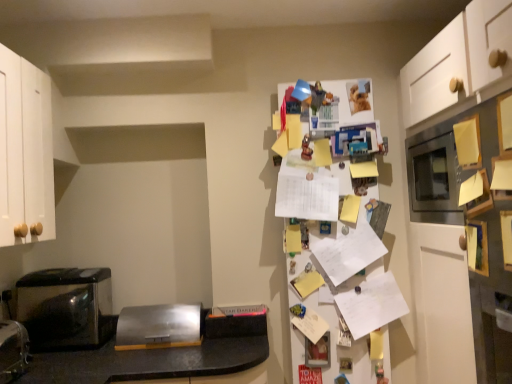
Question: Would you say black stainless steel microwave at lower left, the 1th appliance in the front-to-back sequence, is inside or outside metallic black toaster at left?

Choices:
 (A) inside
 (B) outside

Answer: (B)

Question: From the image's perspective, is black stainless steel microwave at lower left, marked as the 2th appliance in a right-to-left arrangement, positioned above or below metallic black toaster at left?

Choices:
 (A) above
 (B) below

Answer: (B)

Question: Based on their relative distances, which object is nearer to the white paper at center?

Choices:
 (A) white paper covered fridge at upper right
 (B) satin silver toaster at center, arranged as the first appliance when viewed from the right
 (C) metallic black toaster at left
 (D) black stainless steel microwave at lower left, the 2th appliance in the back-to-front sequence

Answer: (A)

Question: Based on their relative distances, which object is farther from the white paper covered fridge at upper right?

Choices:
 (A) satin silver toaster at center, which is the second appliance from left to right
 (B) black stainless steel microwave at lower left, the 1th appliance in the front-to-back sequence
 (C) metallic black toaster at left
 (D) white paper at center

Answer: (B)